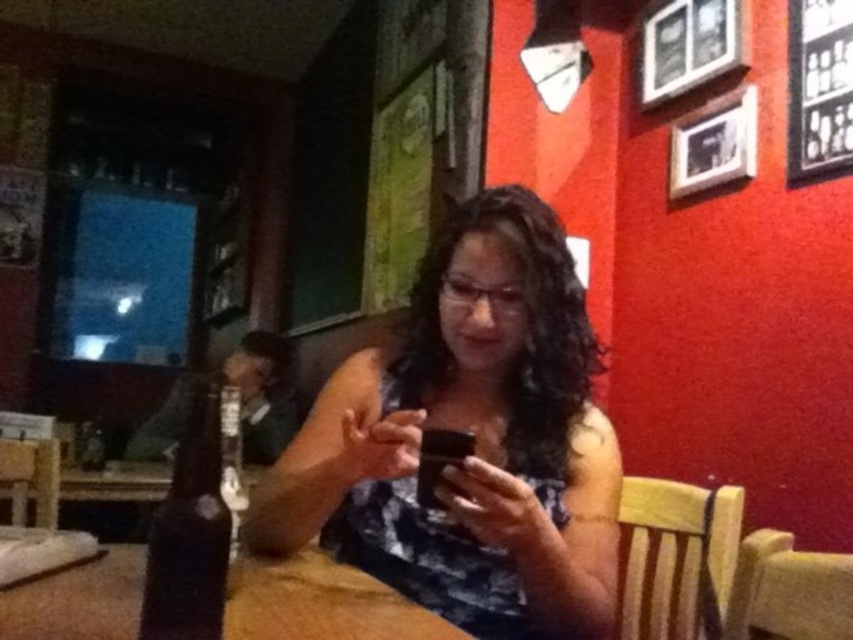
You are a barista trying to place a matte black phone at center on the brown wood table at center. Can you do this without moving the phone or the table?

The matte black phone at center is already above the brown wood table at center, so you can place it there without moving either.

You are a delivery person standing at the entrance of the cafe and need to place a matte black phone at center on a table without disturbing the woman. The phone must be placed exactly 90 centimeters away from the viewer. Can you do it?

The matte black phone at center is currently 92.17 centimeters away from the viewer. Since the required distance is 90 centimeters, it is slightly closer than needed. Adjust the placement to increase the distance by approximately 2.17 centimeters to meet the requirement.

You are a barista in the cafe and need to retrieve the dark brown glass bottle at lower left. However, there is a matte black phone at center in the way. Can you move the phone to access the bottle?

The matte black phone at center is positioned over dark brown glass bottle at lower left, so you can move the phone to access the bottle since it is above the bottle.